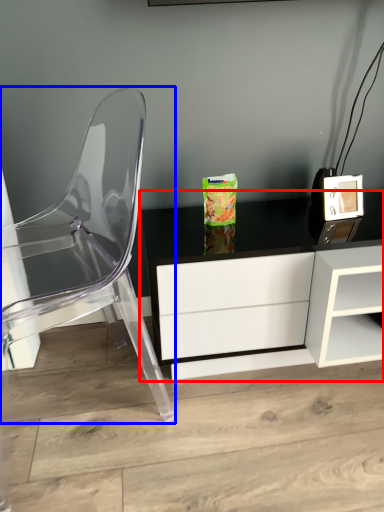
Question: Which object is further to the camera taking this photo, table (highlighted by a red box) or chair (highlighted by a blue box)?

Choices:
 (A) table
 (B) chair

Answer: (A)